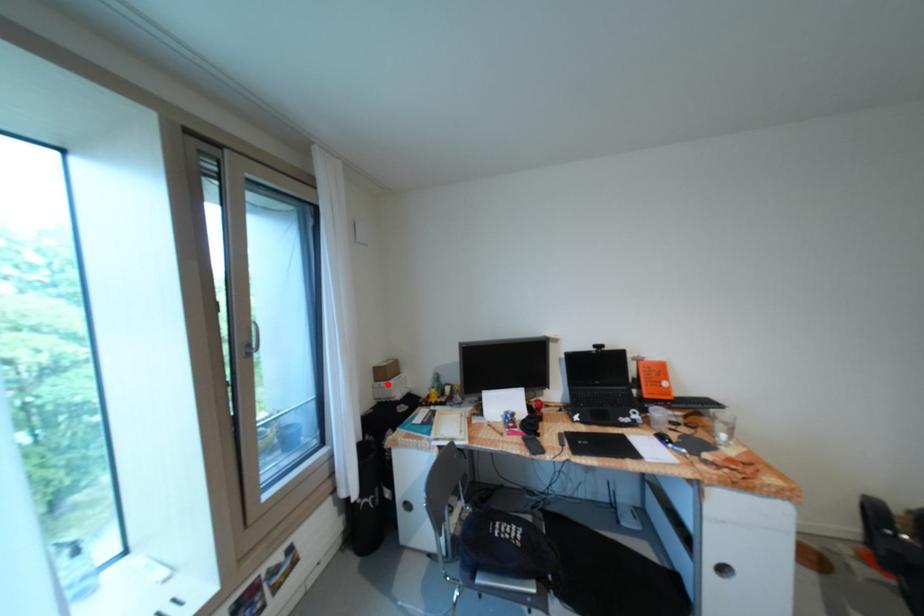
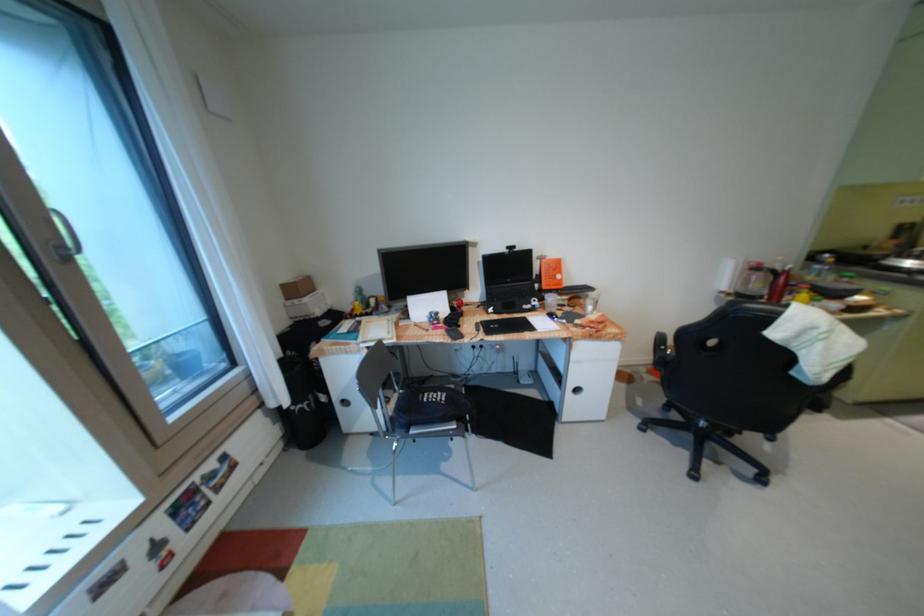
Question: I am providing you with two images of the same scene from different viewpoints. In image1, a red point is highlighted. Considering the same 3D point in image2, which of the following is correct?

Choices:
 (A) It is closer
 (B) It is farther

Answer: (A)